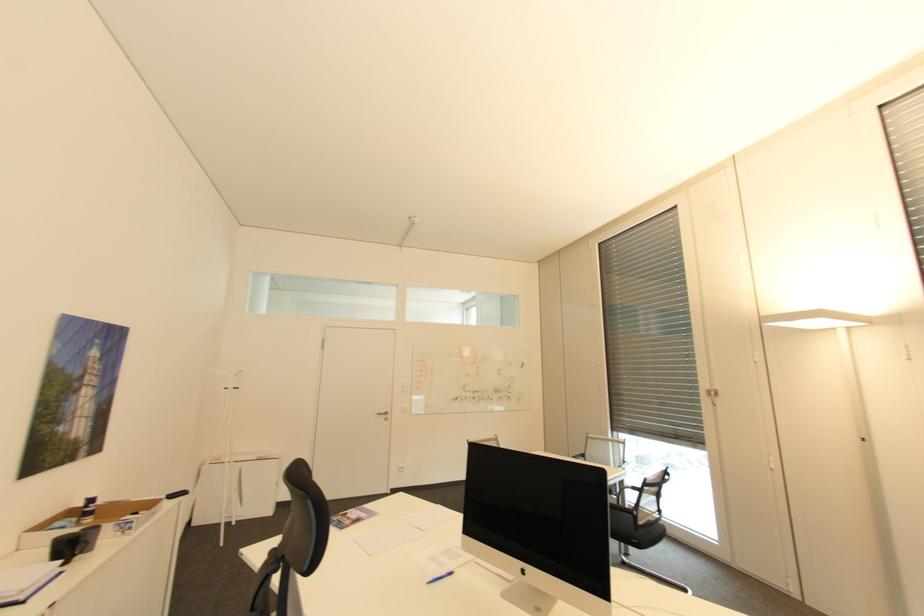
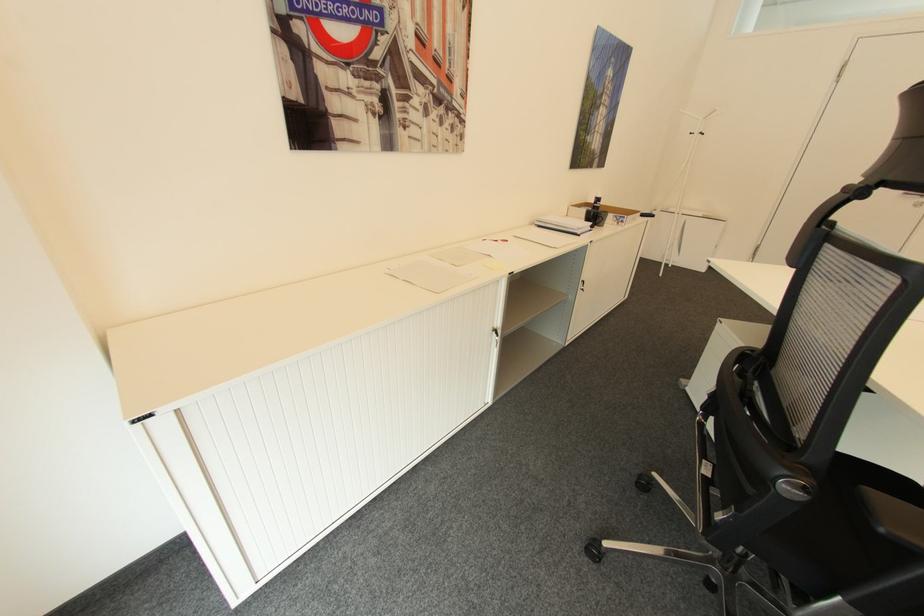
The images are taken continuously from a first-person perspective. In which direction is your viewpoint rotating?

The camera's rotation is toward left-down.